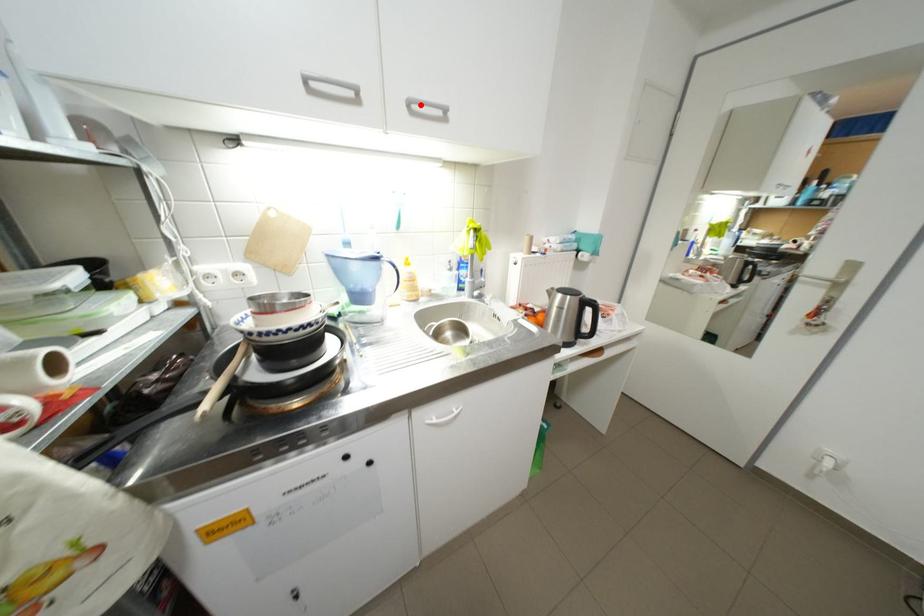
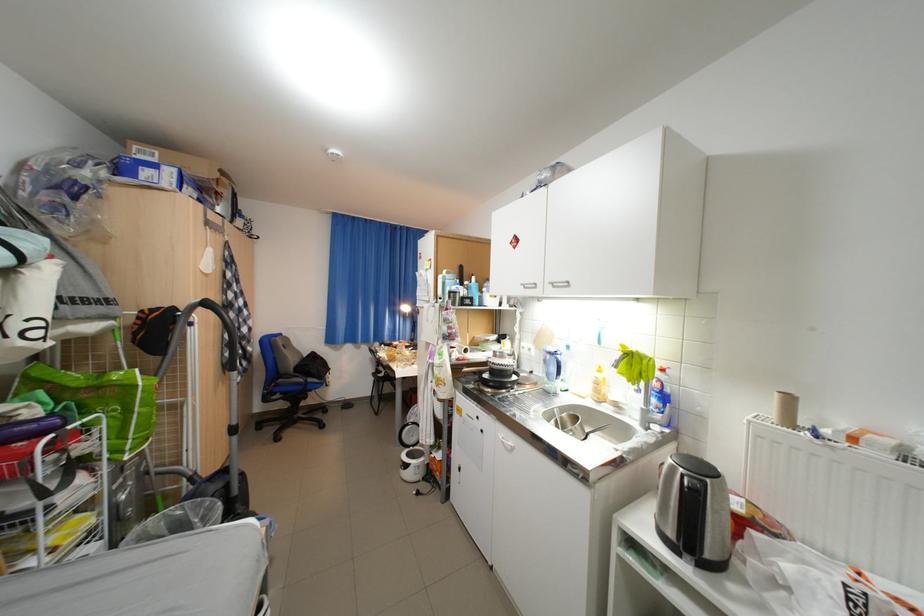
Locate, in the second image, the point that corresponds to the highlighted location in the first image.

(564, 285)